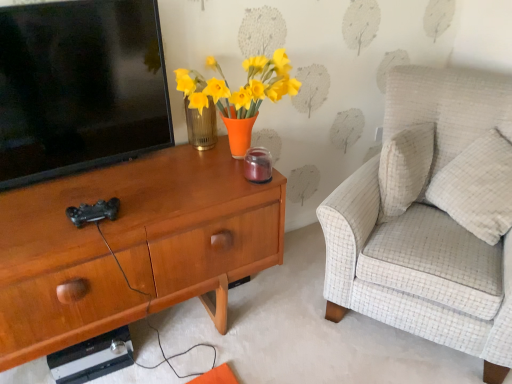
Locate an element on the screen. vacant region to the right of black glossy television at left is located at coordinates (152, 176).